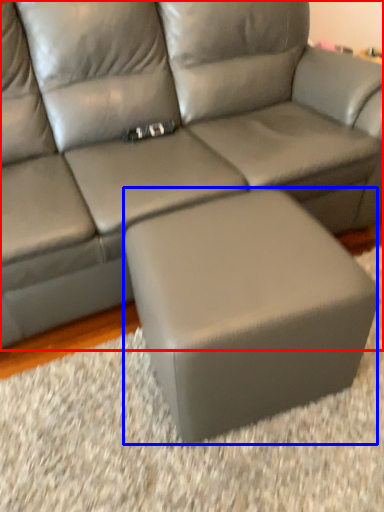
Question: Which object appears closest to the camera in this image, studio couch (highlighted by a red box) or stool (highlighted by a blue box)?

Choices:
 (A) studio couch
 (B) stool

Answer: (A)